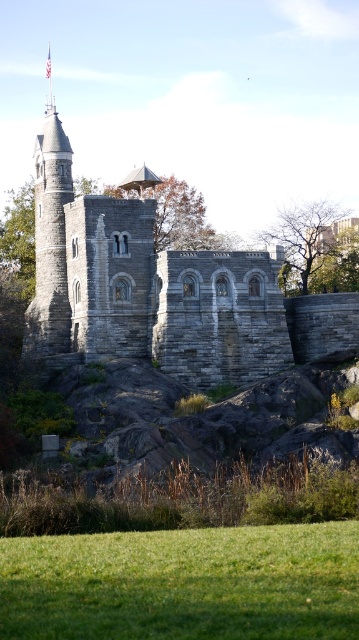
Between point (188, 570) and point (56, 150), which one is positioned in front?

Point (188, 570) is more forward.

Is green grassy field at lower center shorter than gray stone tower at left?

Yes, green grassy field at lower center is shorter than gray stone tower at left.

Is point (64, 593) less distant than point (57, 312)?

Yes, point (64, 593) is closer to viewer.

The width and height of the screenshot is (359, 640). What are the coordinates of `green grassy field at lower center` in the screenshot? It's located at (183, 582).